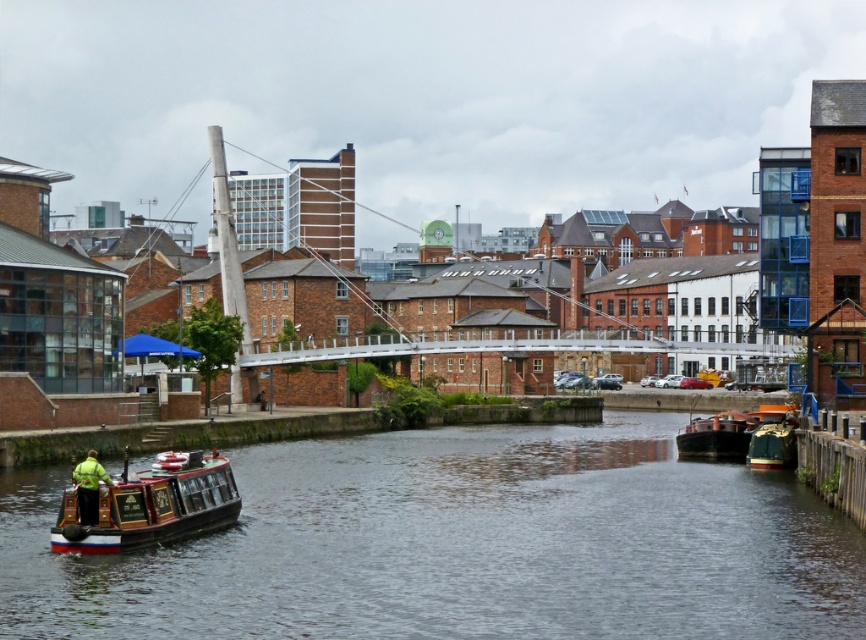
You are a tourist standing on the pedestrian bridge and want to take a photo of the smooth dark water at center and the green fabric boat at lower right. Which object will occupy more space in your photo?

The smooth dark water at center will occupy more space in your photo because it is bigger than the green fabric boat at lower right.

Looking at this image, you are a tourist standing on the bridge in the middle ground of the scene. You see the wooden polished boat at lower left and the green fabric jacket at lower left. Which object is taller from your viewpoint?

The wooden polished boat at lower left is taller than the green fabric jacket at lower left.

You are standing on the pedestrian bridge in the middle ground of the canal scene. You notice a point marked at coordinates [459,545]. What is located at that point?

The point at coordinates [459,545] indicates smooth dark water at center.